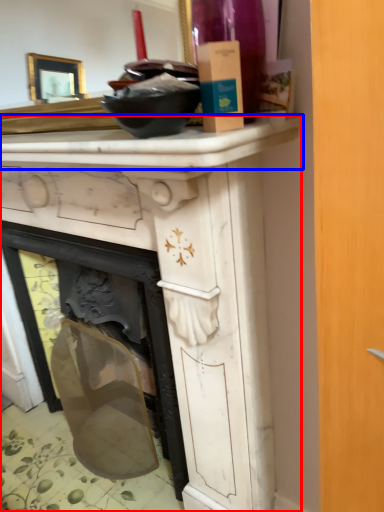
Question: Among these objects, which one is farthest to the camera, vanity (highlighted by a red box) or counter top (highlighted by a blue box)?

Choices:
 (A) vanity
 (B) counter top

Answer: (A)